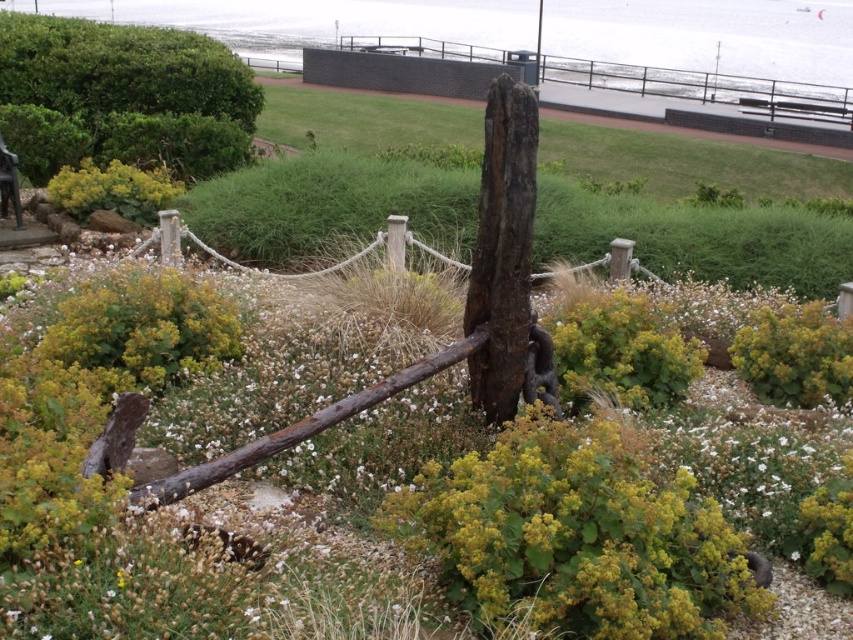
Consider the image. Who is shorter, rustic wooden fence at upper center or yellow-green leafy plant at upper left?

yellow-green leafy plant at upper left is shorter.

Is rustic wooden fence at upper center wider than yellow-green leafy plant at upper left?

Correct, the width of rustic wooden fence at upper center exceeds that of yellow-green leafy plant at upper left.

Who is more distant from viewer, (x=799, y=93) or (x=120, y=173)?

Point (x=799, y=93)

This screenshot has width=853, height=640. What are the coordinates of `rustic wooden fence at upper center` in the screenshot? It's located at point(640,77).

Does rustic wooden fence at upper center come behind wooden park bench at lower left?

Yes, rustic wooden fence at upper center is further from the viewer.

Is point (570, 68) in front of point (0, 212)?

No.

Between point (788, 81) and point (16, 214), which one is positioned in front?

Point (16, 214)

Image resolution: width=853 pixels, height=640 pixels. What are the coordinates of `rustic wooden fence at upper center` in the screenshot? It's located at (640, 77).

Is yellow-green leafy plant at upper left wider than wooden park bench at lower left?

Correct, the width of yellow-green leafy plant at upper left exceeds that of wooden park bench at lower left.

Does yellow-green leafy plant at upper left appear over wooden park bench at lower left?

Correct, yellow-green leafy plant at upper left is located above wooden park bench at lower left.

Who is more forward, (126,204) or (1,196)?

Point (126,204)

I want to click on yellow-green leafy plant at upper left, so click(112, 189).